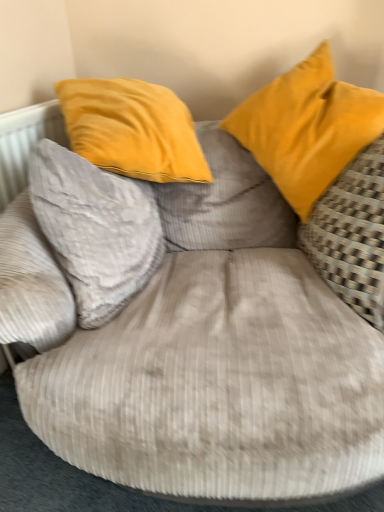
The width and height of the screenshot is (384, 512). Describe the element at coordinates (307, 128) in the screenshot. I see `matte yellow pillow at upper right, which appears as the 2th pillow when viewed from the right` at that location.

You are a GUI agent. You are given a task and a screenshot of the screen. Output one action in this format:
    pyautogui.click(x=<x>, y=<y>)
    Task: Click on the matte yellow pillow at upper right, acting as the 2th pillow starting from the left
    The width and height of the screenshot is (384, 512).
    Given the screenshot: What is the action you would take?
    pyautogui.click(x=307, y=128)

Where is `gray corduroy pillow at left, the 1th pillow in the left-to-right sequence`? gray corduroy pillow at left, the 1th pillow in the left-to-right sequence is located at coordinates (95, 229).

What do you see at coordinates (95, 229) in the screenshot? I see `gray corduroy pillow at left, the 1th pillow in the left-to-right sequence` at bounding box center [95, 229].

What is the approximate width of yellow fabric pillow at right, which is the 3th pillow in left-to-right order?

The width of yellow fabric pillow at right, which is the 3th pillow in left-to-right order, is 33.90 centimeters.

Image resolution: width=384 pixels, height=512 pixels. In order to click on matte yellow pillow at upper right, acting as the 2th pillow starting from the left in this screenshot , I will do `click(307, 128)`.

From a real-world perspective, which is physically below, yellow fabric pillow at right, the 1th pillow viewed from the right, or matte yellow pillow at upper right, which appears as the 2th pillow when viewed from the right?

In real-world perspective, yellow fabric pillow at right, the 1th pillow viewed from the right, is lower.

Could you tell me if yellow fabric pillow at right, which is the 3th pillow in left-to-right order, is facing matte yellow pillow at upper right, which appears as the 2th pillow when viewed from the right?

Yes, yellow fabric pillow at right, which is the 3th pillow in left-to-right order, is turned towards matte yellow pillow at upper right, which appears as the 2th pillow when viewed from the right.

Considering the sizes of objects yellow fabric pillow at right, the 1th pillow viewed from the right, and matte yellow pillow at upper right, acting as the 2th pillow starting from the left, in the image provided, who is thinner, yellow fabric pillow at right, the 1th pillow viewed from the right, or matte yellow pillow at upper right, acting as the 2th pillow starting from the left,?

With smaller width is yellow fabric pillow at right, the 1th pillow viewed from the right.

In terms of width, does matte yellow pillow at upper right, acting as the 2th pillow starting from the left, look wider or thinner when compared to yellow fabric pillow at right, which is the 3th pillow in left-to-right order?

Considering their sizes, matte yellow pillow at upper right, acting as the 2th pillow starting from the left, looks broader than yellow fabric pillow at right, which is the 3th pillow in left-to-right order.

From the picture: From the image's perspective, which is below, matte yellow pillow at upper right, which appears as the 2th pillow when viewed from the right, or yellow fabric pillow at right, the 1th pillow viewed from the right?

yellow fabric pillow at right, the 1th pillow viewed from the right, from the image's perspective.

Between matte yellow pillow at upper right, acting as the 2th pillow starting from the left, and yellow fabric pillow at right, which is the 3th pillow in left-to-right order, which one appears on the left side from the viewer's perspective?

matte yellow pillow at upper right, acting as the 2th pillow starting from the left, is more to the left.

Considering the points (88, 228) and (378, 212), which point is behind, point (88, 228) or point (378, 212)?

The point (88, 228) is more distant.

Is gray corduroy pillow at left, the 1th pillow in the left-to-right sequence, shorter than yellow fabric pillow at right, which is the 3th pillow in left-to-right order?

Yes.

Where is `pillow below the gray corduroy pillow at left, the 1th pillow in the left-to-right sequence (from a real-world perspective)`? Image resolution: width=384 pixels, height=512 pixels. pillow below the gray corduroy pillow at left, the 1th pillow in the left-to-right sequence (from a real-world perspective) is located at coordinates (352, 234).

Considering the sizes of objects yellow fabric pillow at right, the 1th pillow viewed from the right, and gray corduroy pillow at left, which is the 3th pillow in right-to-left order, in the image provided, who is thinner, yellow fabric pillow at right, the 1th pillow viewed from the right, or gray corduroy pillow at left, which is the 3th pillow in right-to-left order,?

yellow fabric pillow at right, the 1th pillow viewed from the right.

From the image's perspective, who appears lower, yellow fabric pillow at right, the 1th pillow viewed from the right, or gray corduroy pillow at left, the 1th pillow in the left-to-right sequence?

gray corduroy pillow at left, the 1th pillow in the left-to-right sequence, from the image's perspective.

Could you tell me if yellow fabric pillow at right, the 1th pillow viewed from the right, is turned towards gray corduroy pillow at left, which is the 3th pillow in right-to-left order?

Yes, yellow fabric pillow at right, the 1th pillow viewed from the right, faces towards gray corduroy pillow at left, which is the 3th pillow in right-to-left order.

In the image, is yellow fabric pillow at right, the 1th pillow viewed from the right, positioned in front of or behind gray corduroy pillow at left, which is the 3th pillow in right-to-left order?

Clearly, yellow fabric pillow at right, the 1th pillow viewed from the right, is in front of gray corduroy pillow at left, which is the 3th pillow in right-to-left order.

Is gray corduroy pillow at left, the 1th pillow in the left-to-right sequence, in contact with matte yellow pillow at upper right, which appears as the 2th pillow when viewed from the right?

No, gray corduroy pillow at left, the 1th pillow in the left-to-right sequence, is not making contact with matte yellow pillow at upper right, which appears as the 2th pillow when viewed from the right.

From a real-world perspective, is gray corduroy pillow at left, which is the 3th pillow in right-to-left order, located beneath matte yellow pillow at upper right, acting as the 2th pillow starting from the left?

Correct, in the physical world, gray corduroy pillow at left, which is the 3th pillow in right-to-left order, is lower than matte yellow pillow at upper right, acting as the 2th pillow starting from the left.

Considering the sizes of objects gray corduroy pillow at left, which is the 3th pillow in right-to-left order, and matte yellow pillow at upper right, acting as the 2th pillow starting from the left, in the image provided, who is smaller, gray corduroy pillow at left, which is the 3th pillow in right-to-left order, or matte yellow pillow at upper right, acting as the 2th pillow starting from the left,?

gray corduroy pillow at left, which is the 3th pillow in right-to-left order.

This screenshot has height=512, width=384. I want to click on pillow located behind the gray corduroy pillow at left, which is the 3th pillow in right-to-left order, so click(307, 128).

From the image's perspective, relative to gray corduroy pillow at left, the 1th pillow in the left-to-right sequence, is matte yellow pillow at upper right, acting as the 2th pillow starting from the left, above or below?

Based on their image positions, matte yellow pillow at upper right, acting as the 2th pillow starting from the left, is located above gray corduroy pillow at left, the 1th pillow in the left-to-right sequence.

Between matte yellow pillow at upper right, which appears as the 2th pillow when viewed from the right, and gray corduroy pillow at left, the 1th pillow in the left-to-right sequence, which one has more height?

matte yellow pillow at upper right, which appears as the 2th pillow when viewed from the right, is taller.

Is matte yellow pillow at upper right, which appears as the 2th pillow when viewed from the right, positioned with its back to gray corduroy pillow at left, the 1th pillow in the left-to-right sequence?

No, matte yellow pillow at upper right, which appears as the 2th pillow when viewed from the right, is not facing away from gray corduroy pillow at left, the 1th pillow in the left-to-right sequence.

Locate an element on the screen. The image size is (384, 512). the 1st pillow to the left when counting from the yellow fabric pillow at right, which is the 3th pillow in left-to-right order is located at coordinates (307, 128).

Where is `pillow on the right of matte yellow pillow at upper right, which appears as the 2th pillow when viewed from the right`? pillow on the right of matte yellow pillow at upper right, which appears as the 2th pillow when viewed from the right is located at coordinates coord(352,234).

Estimate the real-world distances between objects in this image. Which object is further from matte yellow pillow at upper right, acting as the 2th pillow starting from the left, gray corduroy pillow at left, which is the 3th pillow in right-to-left order, or yellow fabric pillow at right, which is the 3th pillow in left-to-right order?

gray corduroy pillow at left, which is the 3th pillow in right-to-left order.

Which object lies nearer to the anchor point gray corduroy pillow at left, which is the 3th pillow in right-to-left order, yellow fabric pillow at right, the 1th pillow viewed from the right, or matte yellow pillow at upper right, acting as the 2th pillow starting from the left?

matte yellow pillow at upper right, acting as the 2th pillow starting from the left, lies closer to gray corduroy pillow at left, which is the 3th pillow in right-to-left order, than the other object.

When comparing their distances from gray corduroy pillow at left, the 1th pillow in the left-to-right sequence, does matte yellow pillow at upper right, which appears as the 2th pillow when viewed from the right, or yellow fabric pillow at right, which is the 3th pillow in left-to-right order, seem further?

Among the two, yellow fabric pillow at right, which is the 3th pillow in left-to-right order, is located further to gray corduroy pillow at left, the 1th pillow in the left-to-right sequence.

When comparing their distances from matte yellow pillow at upper right, acting as the 2th pillow starting from the left, does yellow fabric pillow at right, the 1th pillow viewed from the right, or gray corduroy pillow at left, the 1th pillow in the left-to-right sequence, seem further?

gray corduroy pillow at left, the 1th pillow in the left-to-right sequence, is positioned further to the anchor matte yellow pillow at upper right, acting as the 2th pillow starting from the left.

From the image, which object appears to be farther from yellow fabric pillow at right, the 1th pillow viewed from the right, gray corduroy pillow at left, the 1th pillow in the left-to-right sequence, or matte yellow pillow at upper right, which appears as the 2th pillow when viewed from the right?

gray corduroy pillow at left, the 1th pillow in the left-to-right sequence, is further to yellow fabric pillow at right, the 1th pillow viewed from the right.

Based on their spatial positions, is matte yellow pillow at upper right, acting as the 2th pillow starting from the left, or gray corduroy pillow at left, which is the 3th pillow in right-to-left order, further from yellow fabric pillow at right, the 1th pillow viewed from the right?

gray corduroy pillow at left, which is the 3th pillow in right-to-left order, is positioned further to the anchor yellow fabric pillow at right, the 1th pillow viewed from the right.

Locate an element on the screen. This screenshot has height=512, width=384. pillow situated between gray corduroy pillow at left, the 1th pillow in the left-to-right sequence, and yellow fabric pillow at right, which is the 3th pillow in left-to-right order, from left to right is located at coordinates (307, 128).